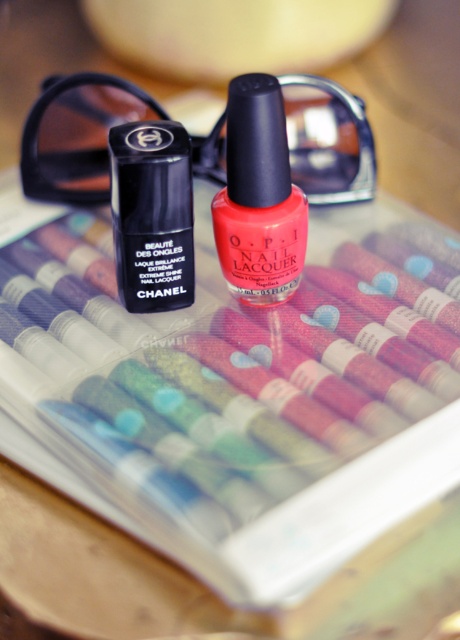
You are organizing a beauty counter and need to place the shiny coral nail polish at center and the matte black nail polish at center next to each other. Based on their widths, which one should be placed on the left to ensure they fit within the available space?

The shiny coral nail polish at center might be wider than matte black nail polish at center, so placing the wider one on the left would ensure they fit within the available space.

You are a photographer setting up a shot of the beauty products. You need to place a small sticker between the two points labeled point [283,232] and point [166,168]. Which point should the sticker be closer to in order to appear closer to the viewer in the final image?

The sticker should be placed closer to point [283,232] because it is closer to the viewer than point [166,168].

You are a photographer setting up a shoot for a beauty catalog. You have two points marked on your camera screen that need to be focused on. The first point is at point (42,156) and the second point is at point (182,161). Since you can only focus on one point at a time, which point should you focus on first to ensure the nail polish bottles in the foreground are sharp?

You should focus on point (42,156) first because it is behind point (182,161), meaning it is closer to the camera and thus requires focusing on the foreground where the nail polish bottles are located.